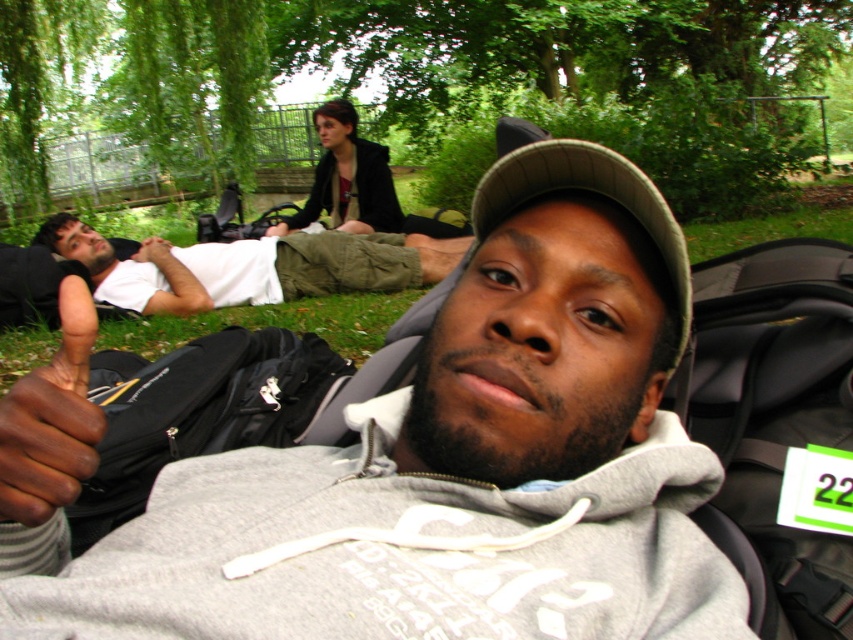
Is gray hoodie at center positioned at the back of white cotton shirt at left?

No, it is not.

Consider the image. Is gray hoodie at center shorter than white cotton shirt at left?

Correct, gray hoodie at center is not as tall as white cotton shirt at left.

The width and height of the screenshot is (853, 640). I want to click on gray hoodie at center, so click(426, 464).